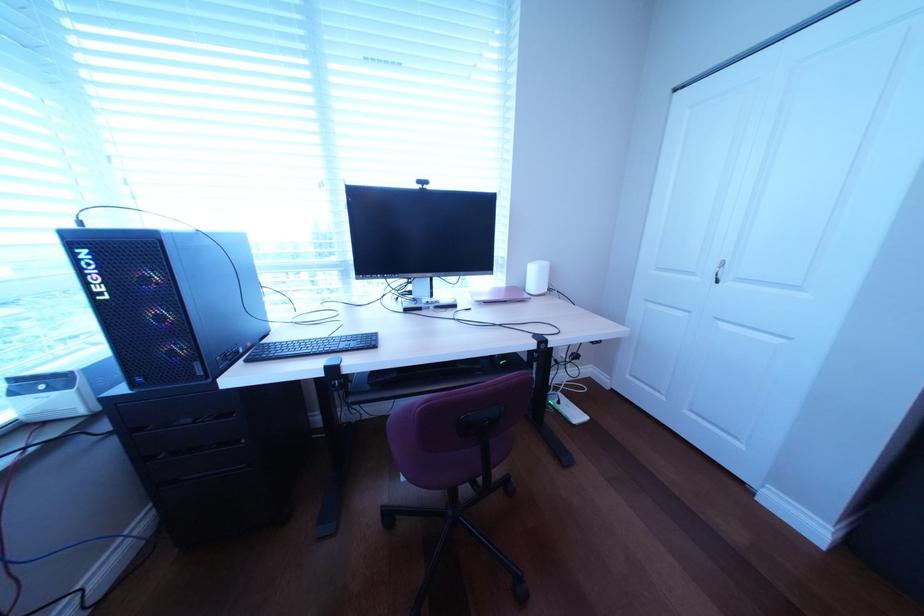
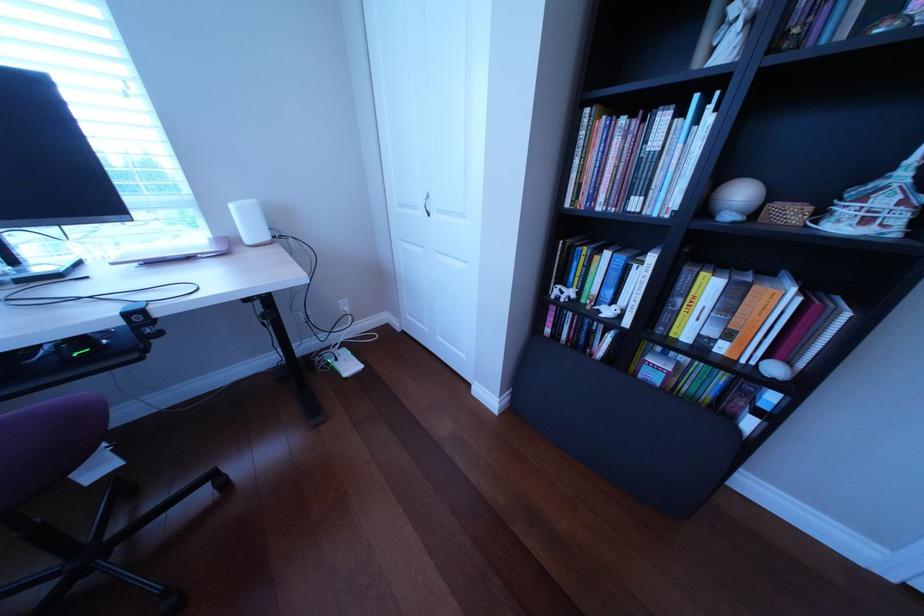
Question: The images are taken continuously from a first-person perspective. In which direction are you moving?

Choices:
 (A) Left
 (B) Right
 (C) Forward
 (D) Backward

Answer: (B)